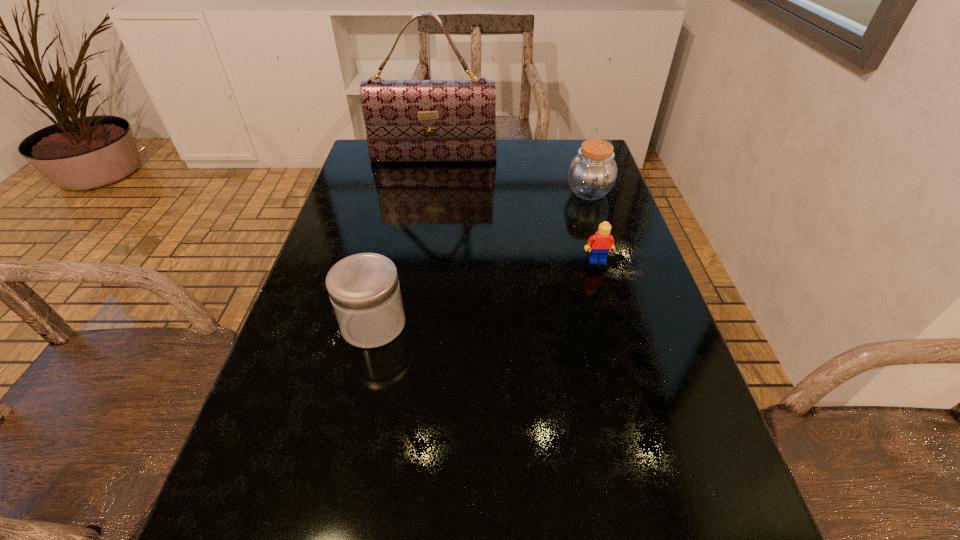
Identify the location of vacant space located 0.080m on the right of the nearest object. The height and width of the screenshot is (540, 960). (445, 324).

Find the location of a particular element. vacant space located on the face of the third farthest object is located at coordinates [620, 341].

Locate an element on the screen. object that is at the far edge is located at coordinates [406, 120].

What are the coordinates of `handbag present at the left edge` in the screenshot? It's located at (406, 120).

Where is `jar at the left edge`? The height and width of the screenshot is (540, 960). jar at the left edge is located at coordinates point(364,290).

Identify the location of jar present at the right edge. The image size is (960, 540). (592, 173).

Locate an element on the screen. The height and width of the screenshot is (540, 960). Lego present at the right edge is located at coordinates (601, 243).

Image resolution: width=960 pixels, height=540 pixels. I want to click on object that is at the far left corner, so tap(406, 120).

In the image, there is a desktop. At what (x,y) coordinates should I click in order to perform the action: click on vacant space at the far edge. Please return your answer as a coordinate pair (x, y). This screenshot has width=960, height=540. Looking at the image, I should click on (469, 170).

This screenshot has height=540, width=960. In the image, there is a desktop. What are the coordinates of `vacant space at the left edge` in the screenshot? It's located at (337, 220).